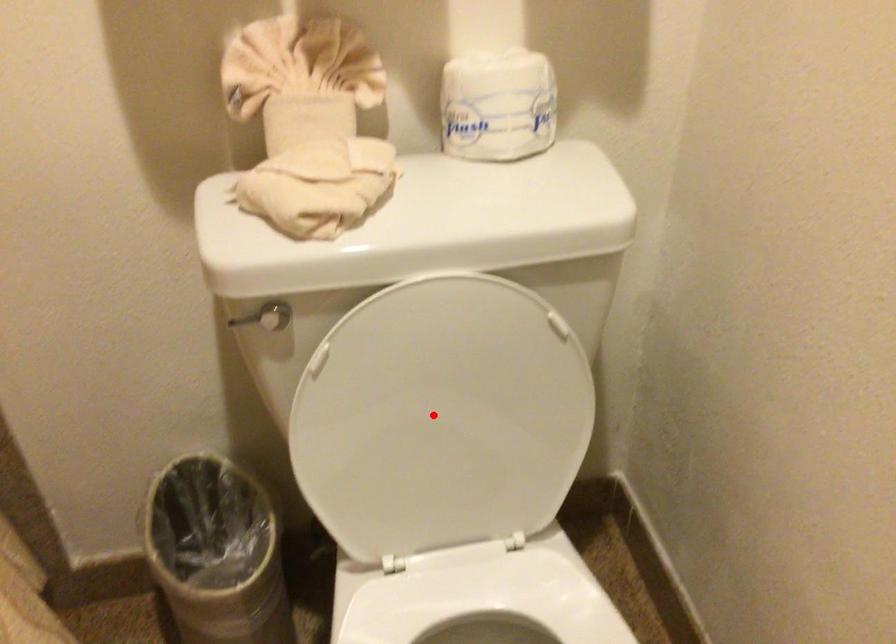
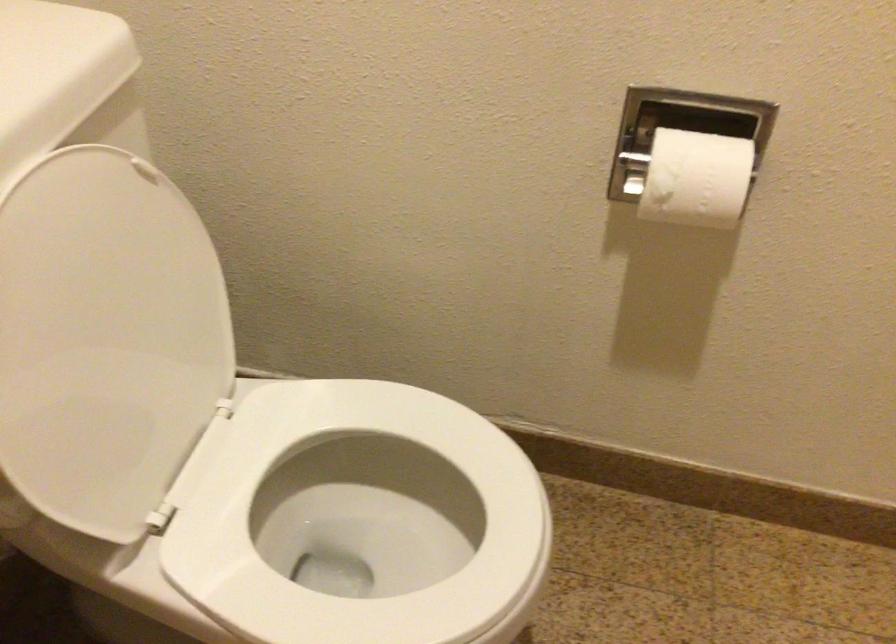
Question: I am providing you with two images of the same scene from different viewpoints. Image1 has a red point marked. In image2, the corresponding 3D location appears at what relative position? Reply with the corresponding letter.

Choices:
 (A) Closer
 (B) Farther

Answer: (A)